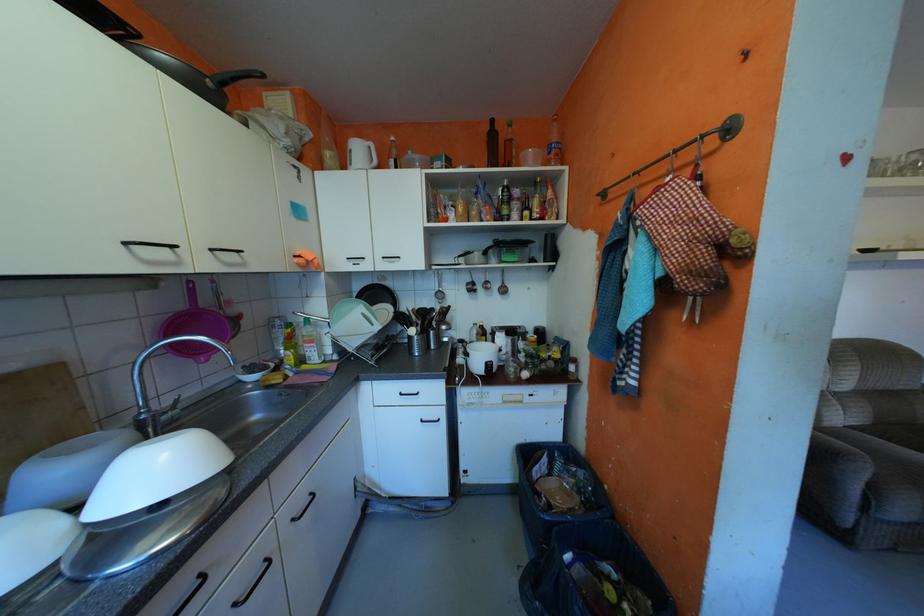
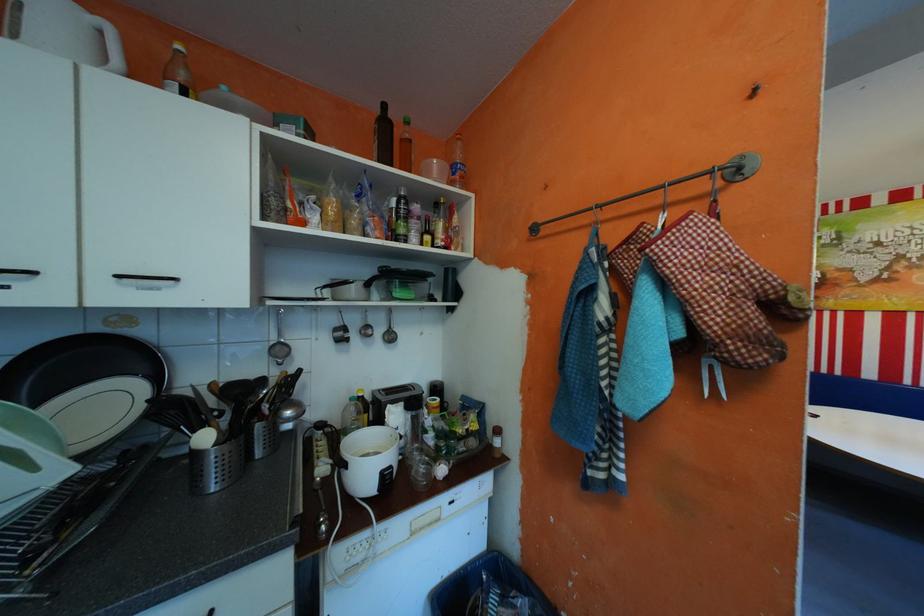
The point at [387,291] is marked in the first image. Where is the corresponding point in the second image?

(105, 353)